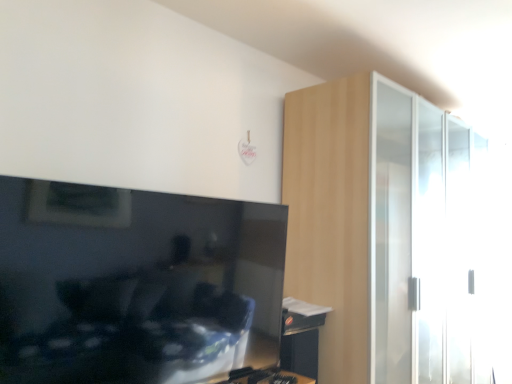
What do you see at coordinates (133, 284) in the screenshot?
I see `matte black tv at left` at bounding box center [133, 284].

In order to face light wood dresser at right, should I rotate leftwards or rightwards?

You should rotate right by 14.984 degrees.

I want to click on wooden table at lower right, so click(x=301, y=336).

Is light wood dresser at right inside matte black tv at left?

That's incorrect, light wood dresser at right is not inside matte black tv at left.

Who is bigger, matte black tv at left or light wood dresser at right?

light wood dresser at right.

In the scene shown: Considering the positions of objects matte black tv at left and light wood dresser at right in the image provided, who is more to the left, matte black tv at left or light wood dresser at right?

matte black tv at left.

Is point (42, 362) positioned behind point (433, 126)?

No, (42, 362) is closer to viewer.

Considering the points (344, 255) and (282, 366), which point is in front, point (344, 255) or point (282, 366)?

Positioned in front is point (282, 366).

Measure the distance from light wood dresser at right to wooden table at lower right.

light wood dresser at right and wooden table at lower right are 26.39 inches apart.

How different are the orientations of light wood dresser at right and wooden table at lower right in degrees?

The facing directions of light wood dresser at right and wooden table at lower right are 2.69 degrees apart.

Is wooden table at lower right surrounded by light wood dresser at right?

Actually, wooden table at lower right is outside light wood dresser at right.

From a real-world perspective, is wooden table at lower right physically below matte black tv at left?

Yes, from a real-world perspective, wooden table at lower right is under matte black tv at left.

Is wooden table at lower right oriented towards matte black tv at left?

No.

What's the angular difference between wooden table at lower right and matte black tv at left's facing directions?

wooden table at lower right and matte black tv at left are facing 1.46 degrees away from each other.

Can you confirm if matte black tv at left is shorter than wooden table at lower right?

No, matte black tv at left is not shorter than wooden table at lower right.

Is matte black tv at left far away from wooden table at lower right?

No, matte black tv at left is in close proximity to wooden table at lower right.

Is matte black tv at left thinner than wooden table at lower right?

Indeed, matte black tv at left has a lesser width compared to wooden table at lower right.

Between point (77, 311) and point (295, 314), which one is positioned in front?

The point (77, 311) is more forward.

Which is behind, light wood dresser at right or matte black tv at left?

light wood dresser at right.

Find the location of a particular element. dresser that appears above the matte black tv at left (from the image's perspective) is located at coordinates (382, 232).

Is light wood dresser at right facing away from matte black tv at left?

That's not correct — light wood dresser at right is not looking away from matte black tv at left.

Which object is positioned more to the left, light wood dresser at right or matte black tv at left?

Positioned to the left is matte black tv at left.

The height and width of the screenshot is (384, 512). I want to click on dresser above the wooden table at lower right (from a real-world perspective), so click(x=382, y=232).

Is wooden table at lower right facing towards light wood dresser at right?

No, wooden table at lower right is not turned towards light wood dresser at right.

Is wooden table at lower right completely or partially outside of light wood dresser at right?

Yes, wooden table at lower right is outside of light wood dresser at right.

From the image's perspective, is wooden table at lower right beneath light wood dresser at right?

Yes, from the image's perspective, wooden table at lower right is beneath light wood dresser at right.

Where is `dresser behind the matte black tv at left`? dresser behind the matte black tv at left is located at coordinates (382, 232).

In the image, there is a light wood dresser at right. What are the coordinates of `table below it (from a real-world perspective)` in the screenshot? It's located at (301, 336).

In the scene shown: Considering their positions, is light wood dresser at right positioned closer to matte black tv at left than wooden table at lower right?

Result: The object closer to matte black tv at left is wooden table at lower right.

From the image, which object appears to be nearer to light wood dresser at right, wooden table at lower right or matte black tv at left?

Among the two, wooden table at lower right is located nearer to light wood dresser at right.

When comparing their distances from wooden table at lower right, does matte black tv at left or light wood dresser at right seem further?

Among the two, light wood dresser at right is located further to wooden table at lower right.

Which object lies nearer to the anchor point wooden table at lower right, light wood dresser at right or matte black tv at left?

matte black tv at left.

When comparing their distances from matte black tv at left, does wooden table at lower right or light wood dresser at right seem closer?

The object closer to matte black tv at left is wooden table at lower right.

Considering their positions, is matte black tv at left positioned closer to light wood dresser at right than wooden table at lower right?

Result: wooden table at lower right is positioned closer to the anchor light wood dresser at right.

Locate an element on the screen. This screenshot has height=384, width=512. dresser between matte black tv at left and wooden table at lower right from front to back is located at coordinates (382, 232).